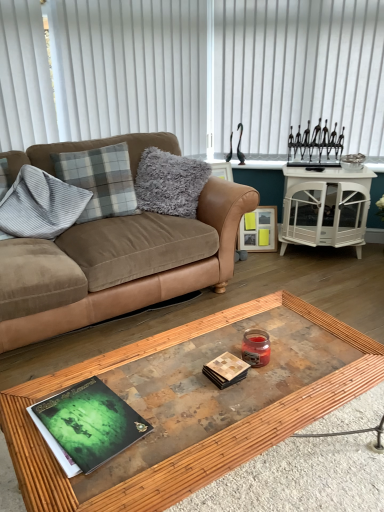
Locate an element on the screen. free space in front of wooden picture frame at upper right is located at coordinates (268, 259).